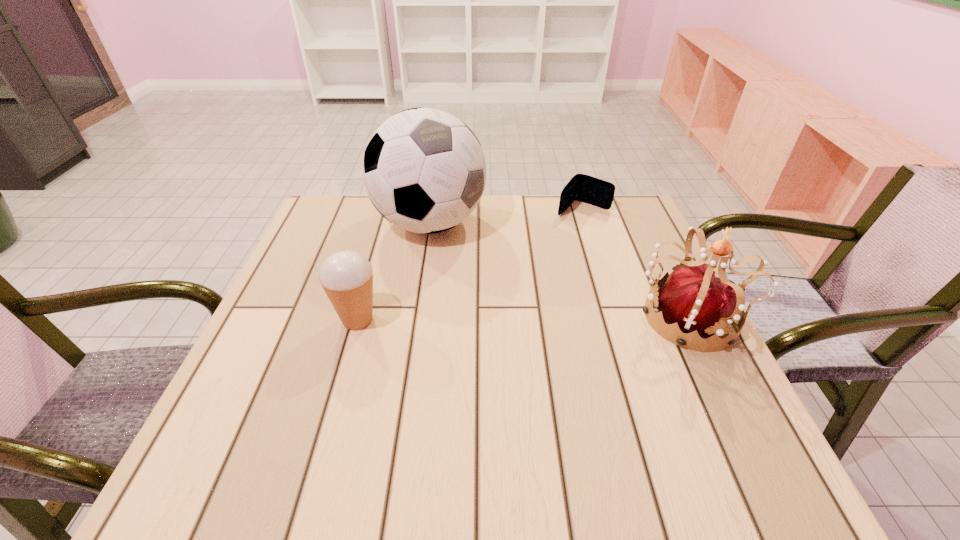
Locate an element on the screen. The width and height of the screenshot is (960, 540). free spot on the desktop that is between the second shortest object and the tiara and is positioned on the outer surface of the shortest object is located at coordinates (486, 319).

This screenshot has width=960, height=540. I want to click on free space on the desktop that is between the icecream and the second tallest object and is positioned on the main logo of the tallest object, so click(x=496, y=319).